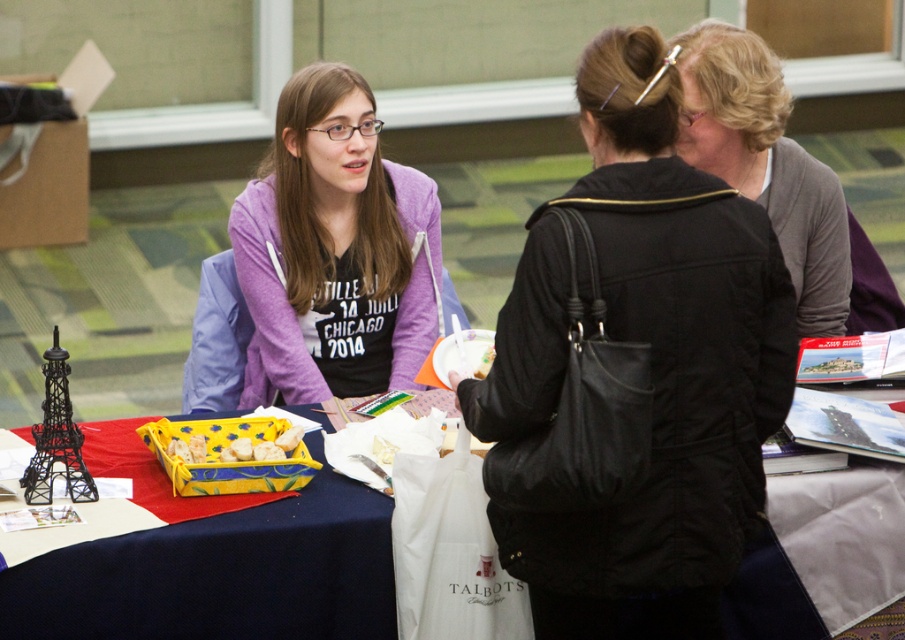
Does gray sweater at upper right appear on the left side of black matte eiffel tower at left?

Incorrect, gray sweater at upper right is not on the left side of black matte eiffel tower at left.

Identify the location of gray sweater at upper right. (765, 163).

Who is positioned more to the right, blue fabric table at center or yellow fabric basket at center?

blue fabric table at center is more to the right.

Which is below, blue fabric table at center or yellow fabric basket at center?

blue fabric table at center is lower down.

Is point (881, 532) behind point (255, 448)?

Yes, it is.

You are a GUI agent. You are given a task and a screenshot of the screen. Output one action in this format:
    pyautogui.click(x=<x>, y=<y>)
    Task: Click on the blue fabric table at center
    
    Given the screenshot: What is the action you would take?
    pyautogui.click(x=220, y=576)

Image resolution: width=905 pixels, height=640 pixels. What do you see at coordinates (220, 576) in the screenshot? I see `blue fabric table at center` at bounding box center [220, 576].

From the picture: Can you confirm if blue fabric table at center is positioned above black matte eiffel tower at left?

Actually, blue fabric table at center is below black matte eiffel tower at left.

Which is behind, point (369, 614) or point (50, 360)?

The point (369, 614) is more distant.

Where is `blue fabric table at center`? blue fabric table at center is located at coordinates (220, 576).